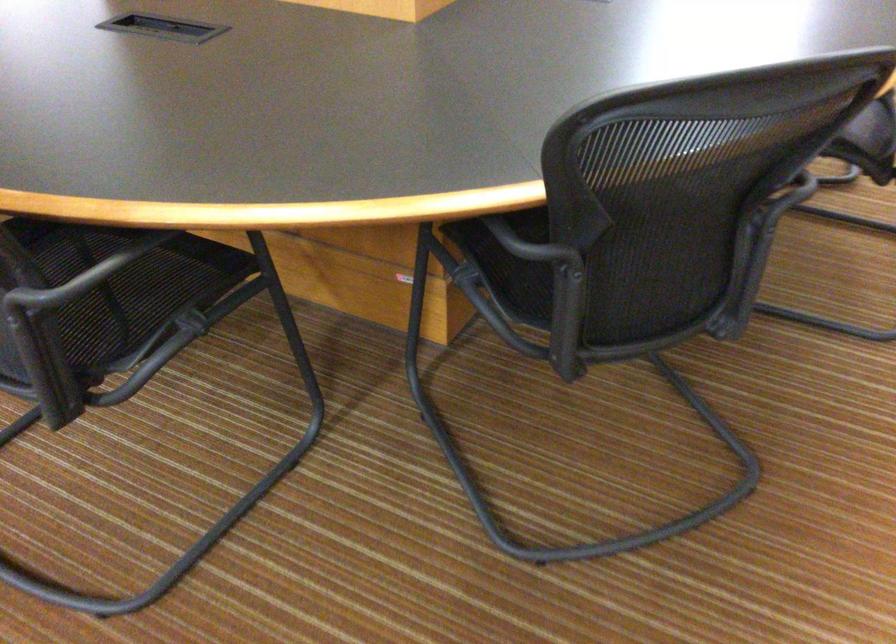
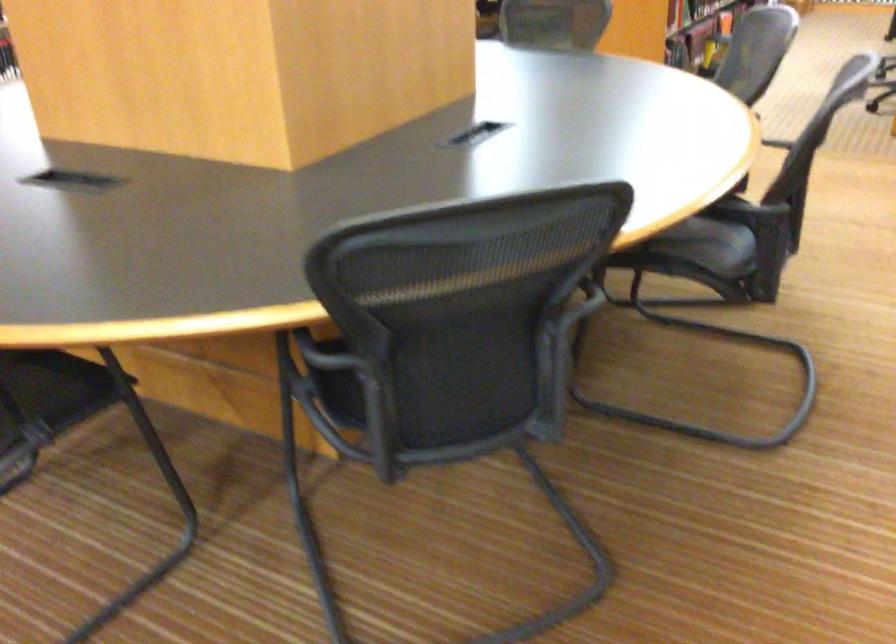
Question: The first image is from the beginning of the video and the second image is from the end. How did the camera likely rotate when shooting the video?

Choices:
 (A) Left
 (B) Right
 (C) Up
 (D) Down

Answer: (C)